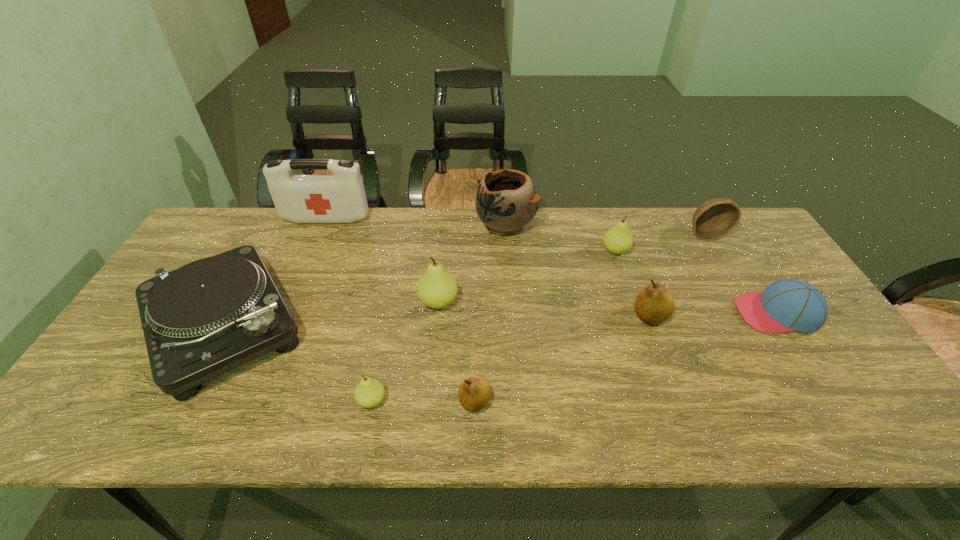
The width and height of the screenshot is (960, 540). In order to click on vacant region that satisfies the following two spatial constraints: 1. on the front side of the blue pottery; 2. on the left side of the farthest pear in this screenshot , I will do `click(507, 251)`.